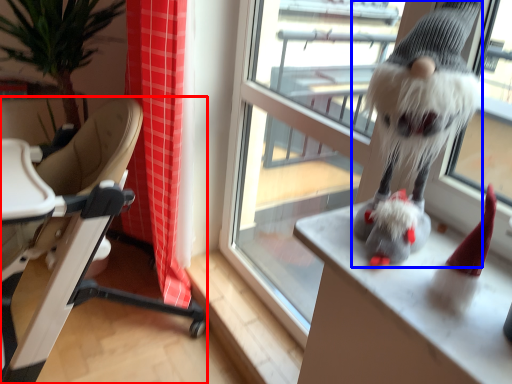
Question: Among these objects, which one is nearest to the camera, chair (highlighted by a red box) or animal (highlighted by a blue box)?

Choices:
 (A) chair
 (B) animal

Answer: (B)